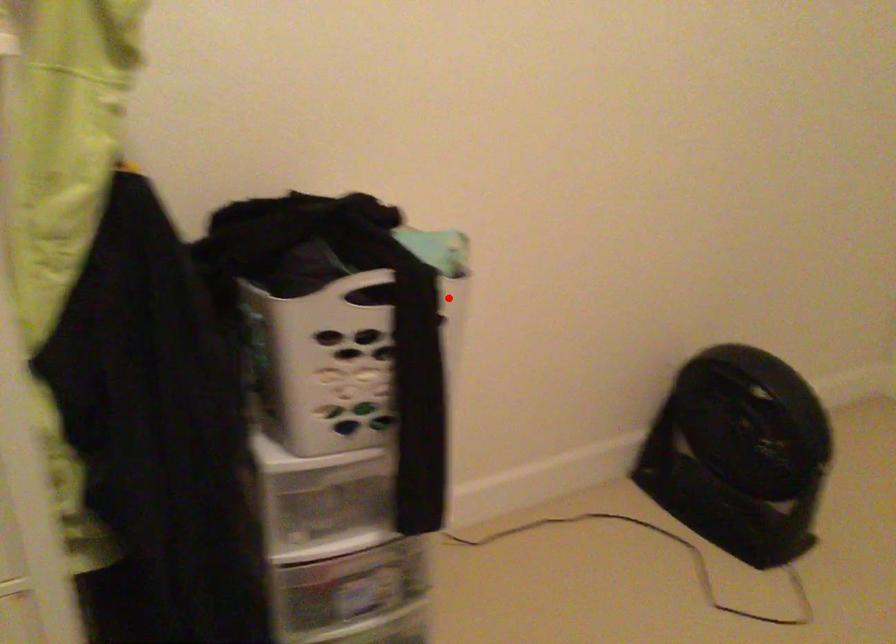
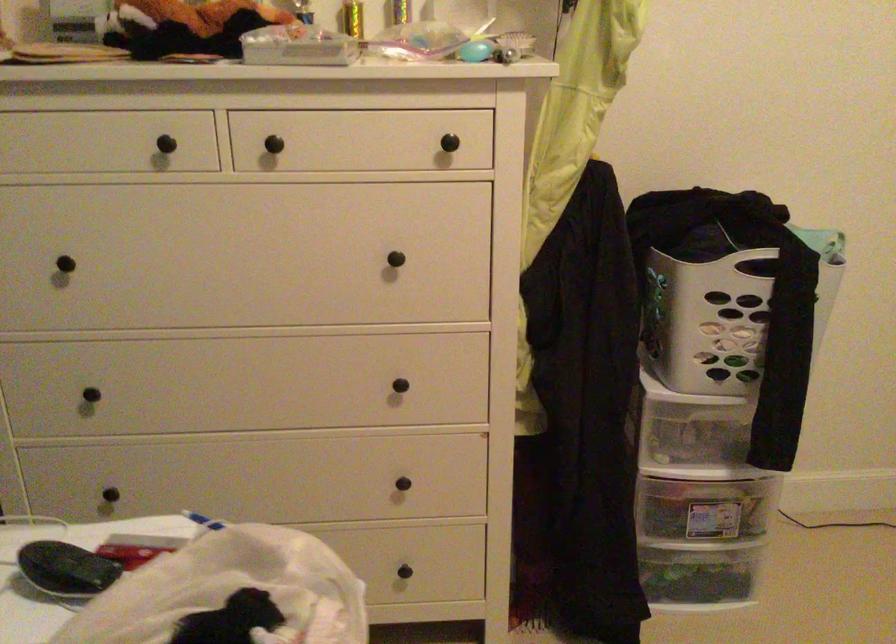
Question: I am providing you with two images of the same scene from different viewpoints. A red point is marked on the first image. At the location where the point appears in image 1, is it still visible in image 2?

Choices:
 (A) Yes
 (B) No

Answer: (A)